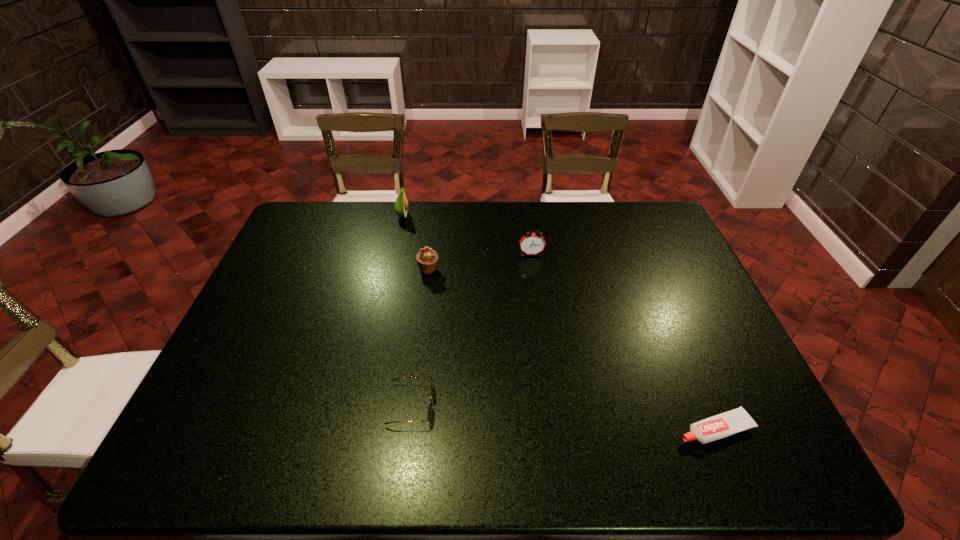
Image resolution: width=960 pixels, height=540 pixels. I want to click on free space between the muffin and the shortest object, so click(x=572, y=349).

Locate an element on the screen. free space between the leftmost object and the second object from right to left is located at coordinates coord(468,235).

This screenshot has width=960, height=540. In order to click on free space between the rightmost object and the muffin in this screenshot , I will do `click(572, 349)`.

Identify the location of free spot between the sunglasses and the avocado. (407, 310).

This screenshot has height=540, width=960. I want to click on object that is the second nearest to the avocado, so click(x=532, y=243).

What are the coordinates of `the fourth closest object relative to the rightmost object` in the screenshot? It's located at (401, 204).

Image resolution: width=960 pixels, height=540 pixels. What are the coordinates of `vacant point that satisfies the following two spatial constraints: 1. on the back side of the toothpaste; 2. on the cut side of the leftmost object` in the screenshot? It's located at (627, 217).

What are the coordinates of `vacant point that satisfies the following two spatial constraints: 1. on the front side of the third nearest object; 2. on the left side of the rightmost object` in the screenshot? It's located at (408, 428).

Where is `free region that satisfies the following two spatial constraints: 1. on the clock face of the second farthest object; 2. on the lenses of the sunglasses`? free region that satisfies the following two spatial constraints: 1. on the clock face of the second farthest object; 2. on the lenses of the sunglasses is located at coordinates (551, 404).

At what (x,y) coordinates should I click in order to perform the action: click on free space that satisfies the following two spatial constraints: 1. on the clock face of the alarm clock; 2. on the left side of the rightmost object. Please return your answer as a coordinate pair (x, y). The image size is (960, 540). Looking at the image, I should click on (555, 428).